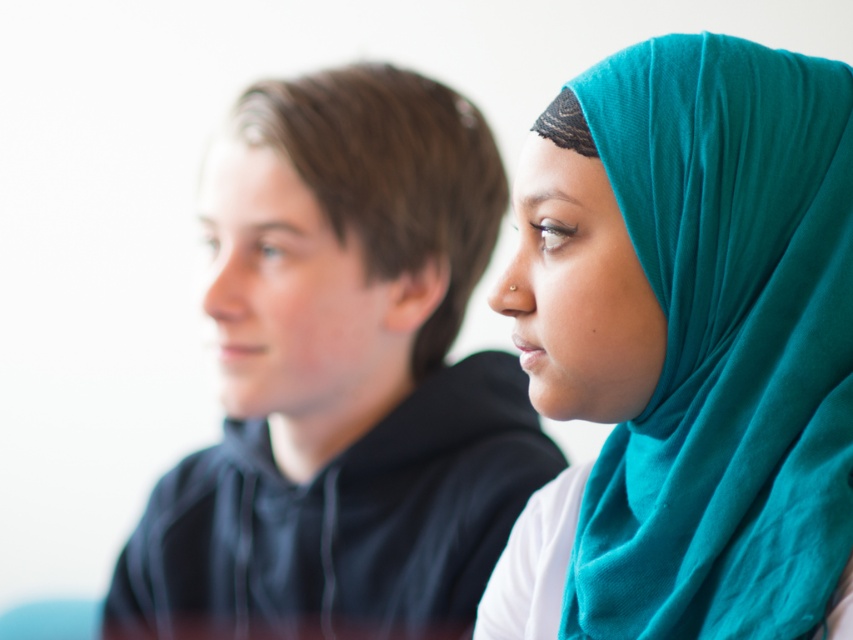
You are a photographer trying to adjust the lighting for a portrait. You have two subjects in the frame, the teal fabric hijab at right and the black matte hoodie at left. Which subject should you focus on to ensure the best depth of field, based on their current positions?

The teal fabric hijab at right is positioned on the right side of black matte hoodie at left. Since the depth of field focuses more sharply on the right individual, you should focus on the teal fabric hijab at right to ensure the best depth of field.

You are a photographer adjusting your camera settings for a portrait. The subject is wearing the teal fabric hijab at right. To ensure the hijab is in focus, what distance should your camera be set to?

The teal fabric hijab at right is 28.93 inches away from the camera, so the camera should be set to focus at 28.93 inches to ensure the hijab is in focus.

You are a photographer who wants to adjust the lighting to focus more on the teal fabric hijab at right. Based on the scene description, where exactly should you direct the light source?

The teal fabric hijab at right is located at coordinates point (694,339). To focus the lighting on it, direct the light source towards those coordinates.